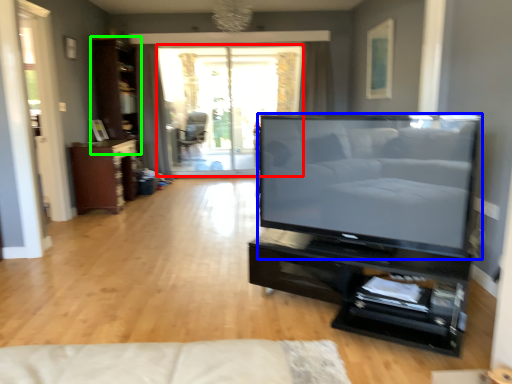
Question: Which object is the farthest from window screen (highlighted by a red box)? Choose among these: television (highlighted by a blue box) or dresser (highlighted by a green box).

Choices:
 (A) television
 (B) dresser

Answer: (A)